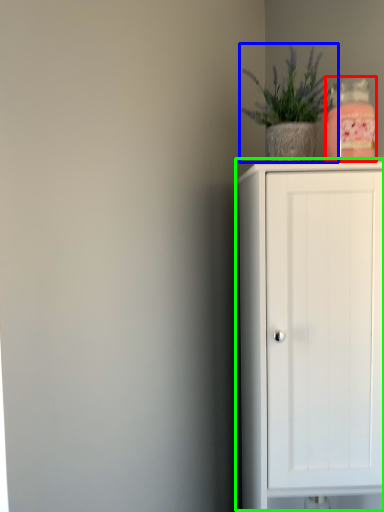
Question: Which object is positioned closest to bottle (highlighted by a red box)? Select from houseplant (highlighted by a blue box) and cupboard (highlighted by a green box).

Choices:
 (A) houseplant
 (B) cupboard

Answer: (A)